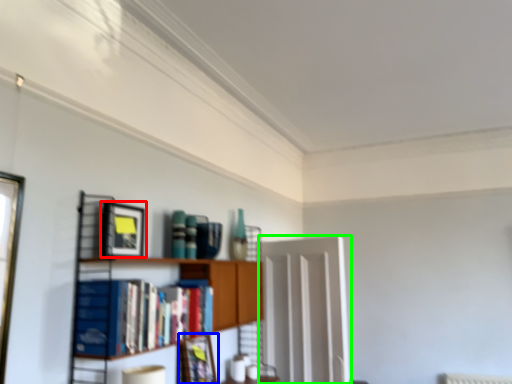
Question: Which object is positioned farthest from picture frame (highlighted by a red box)? Select from picture frame (highlighted by a blue box) and glass door (highlighted by a green box).

Choices:
 (A) picture frame
 (B) glass door

Answer: (B)